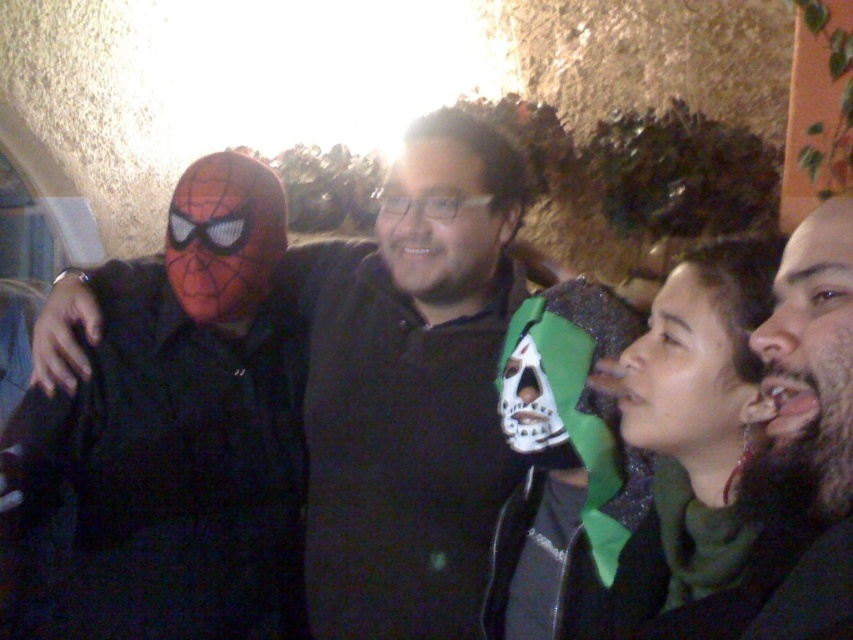
You are standing in front of the group photo taken at night. You notice the matte black mask at left and the green glittery scarf at lower right. Which object is closer to you?

The matte black mask at left is closer to you because it is further to the viewer than the green glittery scarf at lower right.

You are a photographer setting up for a group photo. You notice two features in the scene that might affect lighting adjustments. The matte black mask at left and the bearded dark hair at right. Which of these two features is taller in the image?

The matte black mask at left is taller than the bearded dark hair at right according to the description provided.

You are a photographer adjusting the camera settings to focus on the matte black mask at left. What is the exact coordinate where you should position the focus point?

The matte black mask at left is located at point (410, 388), so you should position the focus point there.